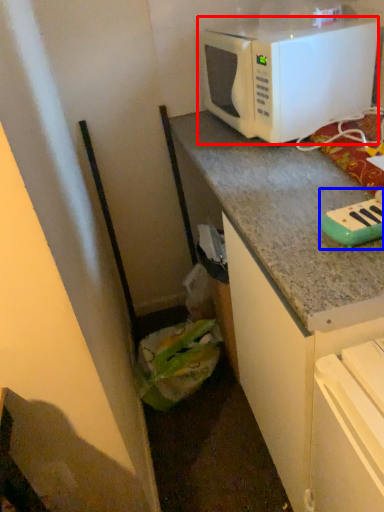
Question: Which of the following is the closest to the observer, microwave oven (highlighted by a red box) or appliance (highlighted by a blue box)?

Choices:
 (A) microwave oven
 (B) appliance

Answer: (B)